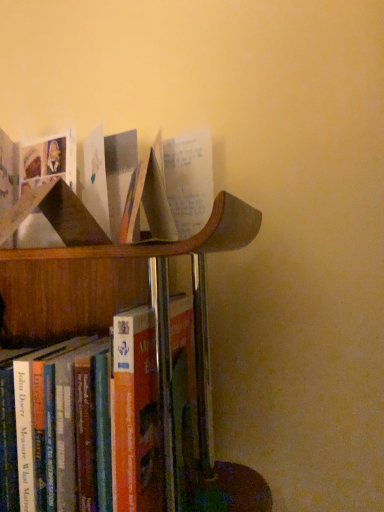
Where is `matte cardboard book at upper left, which is counted as the second book, starting from the bottom`? The width and height of the screenshot is (384, 512). matte cardboard book at upper left, which is counted as the second book, starting from the bottom is located at coordinates (45, 162).

How much space does matte cardboard book at upper left, which is counted as the second book, starting from the bottom, occupy horizontally?

It is 6.90 centimeters.

What do you see at coordinates (45, 162) in the screenshot? I see `matte cardboard book at upper left, marked as the 1th book in a top-to-bottom arrangement` at bounding box center [45, 162].

In order to click on hardcover book at lower left, arranged as the 2th book when viewed from the top in this screenshot , I will do `click(86, 423)`.

This screenshot has height=512, width=384. What do you see at coordinates (86, 423) in the screenshot?
I see `hardcover book at lower left, arranged as the 2th book when viewed from the top` at bounding box center [86, 423].

Where is `matte cardboard book at upper left, marked as the 1th book in a top-to-bottom arrangement`? The height and width of the screenshot is (512, 384). matte cardboard book at upper left, marked as the 1th book in a top-to-bottom arrangement is located at coordinates 45,162.

Which object is positioned more to the left, matte cardboard book at upper left, marked as the 1th book in a top-to-bottom arrangement, or hardcover book at lower left, arranged as the 2th book when viewed from the top?

Positioned to the left is hardcover book at lower left, arranged as the 2th book when viewed from the top.

In the scene shown: Is matte cardboard book at upper left, marked as the 1th book in a top-to-bottom arrangement, in front of hardcover book at lower left, arranged as the 2th book when viewed from the top?

Yes, matte cardboard book at upper left, marked as the 1th book in a top-to-bottom arrangement, is in front of hardcover book at lower left, arranged as the 2th book when viewed from the top.

Is point (12, 163) closer or farther from the camera than point (127, 437)?

Point (12, 163) is positioned farther from the camera compared to point (127, 437).

From the image's perspective, is matte cardboard book at upper left, marked as the 1th book in a top-to-bottom arrangement, above or below hardcover book at lower left, the 1th book positioned from the bottom?

Based on their image positions, matte cardboard book at upper left, marked as the 1th book in a top-to-bottom arrangement, is located above hardcover book at lower left, the 1th book positioned from the bottom.

From a real-world perspective, who is located lower, matte cardboard book at upper left, which is counted as the second book, starting from the bottom, or hardcover book at lower left, the 1th book positioned from the bottom?

hardcover book at lower left, the 1th book positioned from the bottom, from a real-world perspective.

Is matte cardboard book at upper left, marked as the 1th book in a top-to-bottom arrangement, thinner than hardcover book at lower left, arranged as the 2th book when viewed from the top?

Yes, matte cardboard book at upper left, marked as the 1th book in a top-to-bottom arrangement, is thinner than hardcover book at lower left, arranged as the 2th book when viewed from the top.

Considering the relative sizes of matte cardboard book at upper left, marked as the 1th book in a top-to-bottom arrangement, and hardcover book at lower left, the 1th book positioned from the bottom, in the image provided, is matte cardboard book at upper left, marked as the 1th book in a top-to-bottom arrangement, taller than hardcover book at lower left, the 1th book positioned from the bottom,?

No, matte cardboard book at upper left, marked as the 1th book in a top-to-bottom arrangement, is not taller than hardcover book at lower left, the 1th book positioned from the bottom.

Who is smaller, matte cardboard book at upper left, which is counted as the second book, starting from the bottom, or hardcover book at lower left, arranged as the 2th book when viewed from the top?

With smaller size is matte cardboard book at upper left, which is counted as the second book, starting from the bottom.

Would you say matte cardboard book at upper left, which is counted as the second book, starting from the bottom, is outside hardcover book at lower left, the 1th book positioned from the bottom?

Yes.

Are matte cardboard book at upper left, marked as the 1th book in a top-to-bottom arrangement, and hardcover book at lower left, the 1th book positioned from the bottom, far apart?

matte cardboard book at upper left, marked as the 1th book in a top-to-bottom arrangement, is actually quite close to hardcover book at lower left, the 1th book positioned from the bottom.

Is matte cardboard book at upper left, marked as the 1th book in a top-to-bottom arrangement, oriented towards hardcover book at lower left, the 1th book positioned from the bottom?

No, matte cardboard book at upper left, marked as the 1th book in a top-to-bottom arrangement, is not turned towards hardcover book at lower left, the 1th book positioned from the bottom.

How many degrees apart are the facing directions of matte cardboard book at upper left, which is counted as the second book, starting from the bottom, and hardcover book at lower left, arranged as the 2th book when viewed from the top?

39.5 degrees separate the facing orientations of matte cardboard book at upper left, which is counted as the second book, starting from the bottom, and hardcover book at lower left, arranged as the 2th book when viewed from the top.

This screenshot has height=512, width=384. What are the coordinates of `book behind the matte cardboard book at upper left, which is counted as the second book, starting from the bottom` in the screenshot? It's located at (86, 423).

Between hardcover book at lower left, arranged as the 2th book when viewed from the top, and matte cardboard book at upper left, which is counted as the second book, starting from the bottom, which one appears on the right side from the viewer's perspective?

matte cardboard book at upper left, which is counted as the second book, starting from the bottom.

Is hardcover book at lower left, arranged as the 2th book when viewed from the top, closer to the viewer compared to matte cardboard book at upper left, which is counted as the second book, starting from the bottom?

No, hardcover book at lower left, arranged as the 2th book when viewed from the top, is further to the viewer.

Does point (83, 489) come farther from viewer compared to point (27, 152)?

No.

From the image's perspective, would you say hardcover book at lower left, the 1th book positioned from the bottom, is shown under matte cardboard book at upper left, marked as the 1th book in a top-to-bottom arrangement?

Indeed, from the image's perspective, hardcover book at lower left, the 1th book positioned from the bottom, is shown beneath matte cardboard book at upper left, marked as the 1th book in a top-to-bottom arrangement.

From a real-world perspective, which object rests below the other?

hardcover book at lower left, the 1th book positioned from the bottom, is physically lower.

Which object is thinner, hardcover book at lower left, arranged as the 2th book when viewed from the top, or matte cardboard book at upper left, which is counted as the second book, starting from the bottom?

matte cardboard book at upper left, which is counted as the second book, starting from the bottom.

Considering the sizes of hardcover book at lower left, the 1th book positioned from the bottom, and matte cardboard book at upper left, marked as the 1th book in a top-to-bottom arrangement, in the image, is hardcover book at lower left, the 1th book positioned from the bottom, taller or shorter than matte cardboard book at upper left, marked as the 1th book in a top-to-bottom arrangement,?

hardcover book at lower left, the 1th book positioned from the bottom, is taller than matte cardboard book at upper left, marked as the 1th book in a top-to-bottom arrangement.

Considering the sizes of hardcover book at lower left, arranged as the 2th book when viewed from the top, and matte cardboard book at upper left, marked as the 1th book in a top-to-bottom arrangement, in the image, is hardcover book at lower left, arranged as the 2th book when viewed from the top, bigger or smaller than matte cardboard book at upper left, marked as the 1th book in a top-to-bottom arrangement,?

In the image, hardcover book at lower left, arranged as the 2th book when viewed from the top, appears to be larger than matte cardboard book at upper left, marked as the 1th book in a top-to-bottom arrangement.

Would you say hardcover book at lower left, arranged as the 2th book when viewed from the top, is outside matte cardboard book at upper left, marked as the 1th book in a top-to-bottom arrangement?

Yes.

Is hardcover book at lower left, arranged as the 2th book when viewed from the top, next to matte cardboard book at upper left, which is counted as the second book, starting from the bottom?

No, hardcover book at lower left, arranged as the 2th book when viewed from the top, is not next to matte cardboard book at upper left, which is counted as the second book, starting from the bottom.

Is hardcover book at lower left, arranged as the 2th book when viewed from the top, positioned with its back to matte cardboard book at upper left, marked as the 1th book in a top-to-bottom arrangement?

That's not correct — hardcover book at lower left, arranged as the 2th book when viewed from the top, is not looking away from matte cardboard book at upper left, marked as the 1th book in a top-to-bottom arrangement.

The image size is (384, 512). I want to click on book on the right of hardcover book at lower left, arranged as the 2th book when viewed from the top, so click(45, 162).

The width and height of the screenshot is (384, 512). In order to click on book behind the matte cardboard book at upper left, marked as the 1th book in a top-to-bottom arrangement in this screenshot , I will do `click(86, 423)`.

This screenshot has height=512, width=384. In the image, there is a matte cardboard book at upper left, which is counted as the second book, starting from the bottom. What are the coordinates of `book below it (from a real-world perspective)` in the screenshot? It's located at (86, 423).